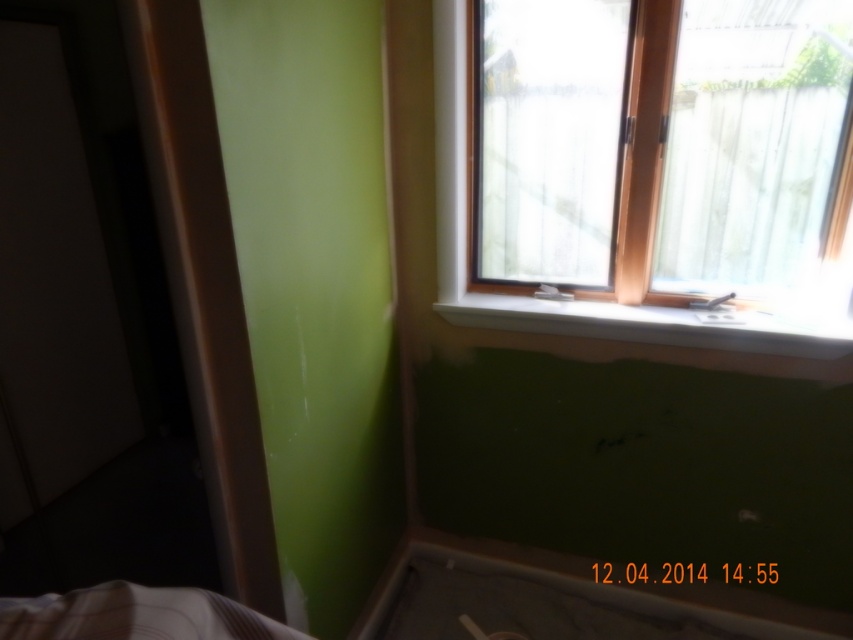
You are a painter working on this room. You have a paintbrush that is 4 inches long. You need to paint the area between the wooden frame at upper right and the white smooth window sill at upper center. Can your paintbrush reach the entire space between them without needing to move your hand?

The wooden frame at upper right is 3.07 inches away from the white smooth window sill at upper center. Since the paintbrush is 4 inches long, it can easily reach the entire space between them without needing to move your hand.

You are a painter who needs to hang a picture frame on the wall. You have two options for placement next to the window. The wooden frame at upper right and the white smooth window sill at upper center. Which location would allow the frame to be placed higher up?

The wooden frame at upper right is much taller than the white smooth window sill at upper center, so placing the picture frame next to the wooden frame at upper right would allow it to be placed higher up.